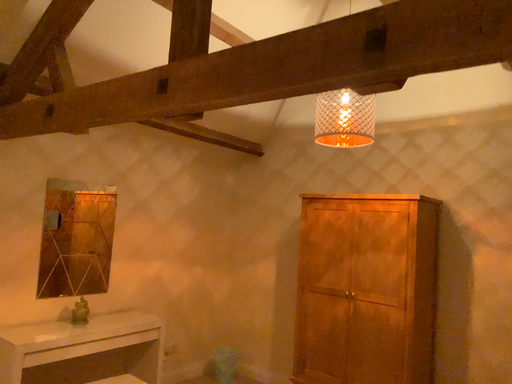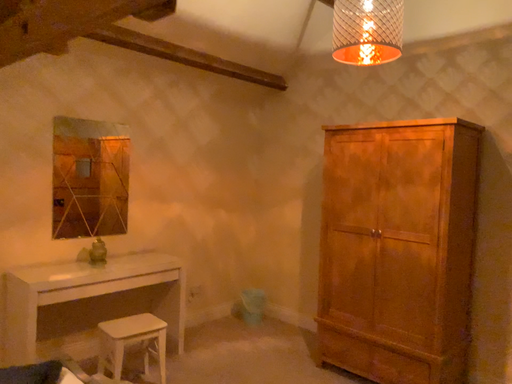
Question: Which way did the camera rotate in the video?

Choices:
 (A) rotated downward
 (B) rotated upward

Answer: (A)